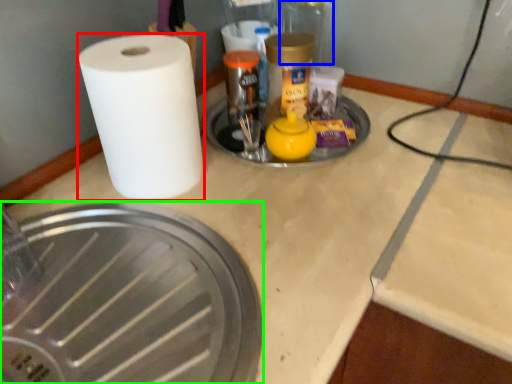
Question: Estimate the real-world distances between objects in this image. Which object is farther from paper towel (highlighted by a red box), glass jar (highlighted by a blue box) or manhole cover (highlighted by a green box)?

Choices:
 (A) glass jar
 (B) manhole cover

Answer: (A)